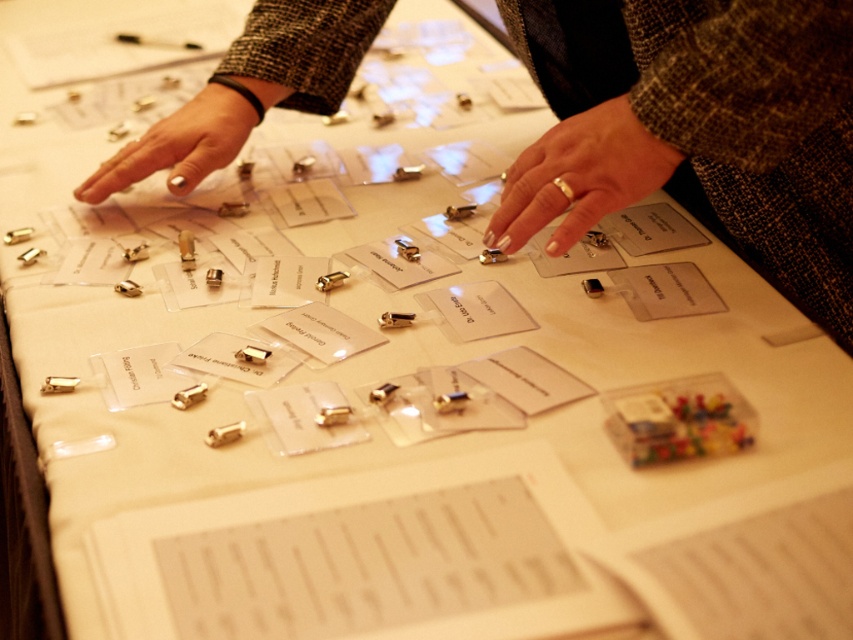
From the picture: Is silver metallic ring at center bigger than nail polish at center?

Actually, silver metallic ring at center might be smaller than nail polish at center.

Can you confirm if silver metallic ring at center is thinner than nail polish at center?

Yes, silver metallic ring at center is thinner than nail polish at center.

Is point (631, 189) in front of point (177, 180)?

Yes, point (631, 189) is in front of point (177, 180).

This screenshot has height=640, width=853. Identify the location of silver metallic ring at center. (579, 177).